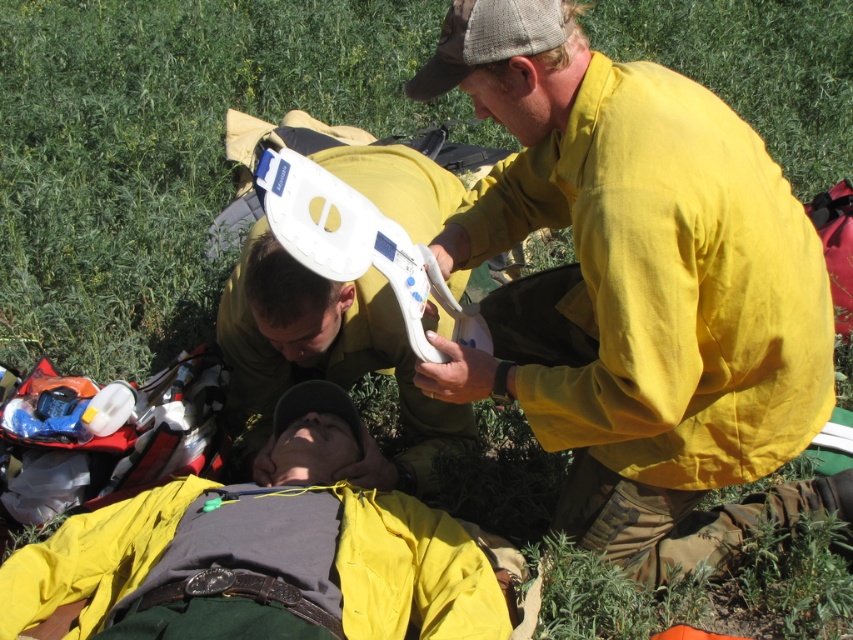
Does yellow fabric shirt at upper right come in front of white plastic device at center?

Yes, yellow fabric shirt at upper right is closer to the viewer.

Between yellow fabric shirt at upper right and white plastic device at center, which one appears on the left side from the viewer's perspective?

From the viewer's perspective, white plastic device at center appears more on the left side.

Which is in front, point (554, 80) or point (372, 224)?

Point (554, 80) is in front.

In order to click on yellow fabric shirt at upper right in this screenshot , I will do `click(636, 289)`.

Does yellow fabric shirt at upper right appear on the left side of yellow fabric at center?

Incorrect, yellow fabric shirt at upper right is not on the left side of yellow fabric at center.

Is yellow fabric shirt at upper right above yellow fabric at center?

Correct, yellow fabric shirt at upper right is located above yellow fabric at center.

Identify the location of yellow fabric shirt at upper right. (636, 289).

Find the location of a particular element. yellow fabric shirt at upper right is located at coordinates (636, 289).

Who is positioned more to the left, yellow fabric at center or white plastic device at center?

From the viewer's perspective, yellow fabric at center appears more on the left side.

Is the position of yellow fabric at center more distant than that of white plastic device at center?

Yes, yellow fabric at center is further from the viewer.

Which is in front, point (132, 618) or point (326, 204)?

Point (326, 204) is more forward.

The width and height of the screenshot is (853, 640). I want to click on yellow fabric at center, so click(263, 554).